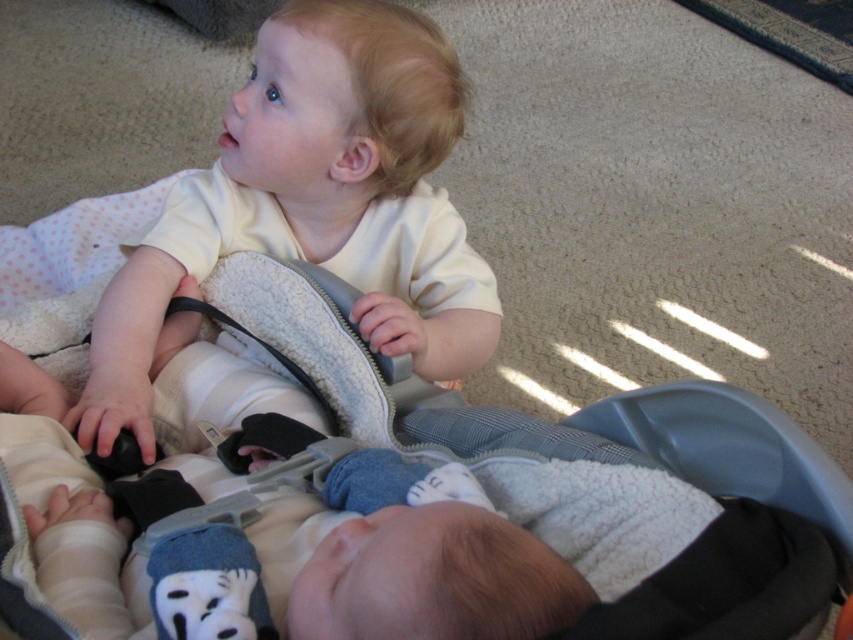
Between point (257, 74) and point (515, 416), which one is positioned behind?

The point (257, 74) is behind.

This screenshot has width=853, height=640. What do you see at coordinates (314, 204) in the screenshot?
I see `matte white onesie at center` at bounding box center [314, 204].

Does point (281, 163) come behind point (682, 544)?

Yes, point (281, 163) is behind point (682, 544).

The height and width of the screenshot is (640, 853). I want to click on matte white onesie at center, so click(x=314, y=204).